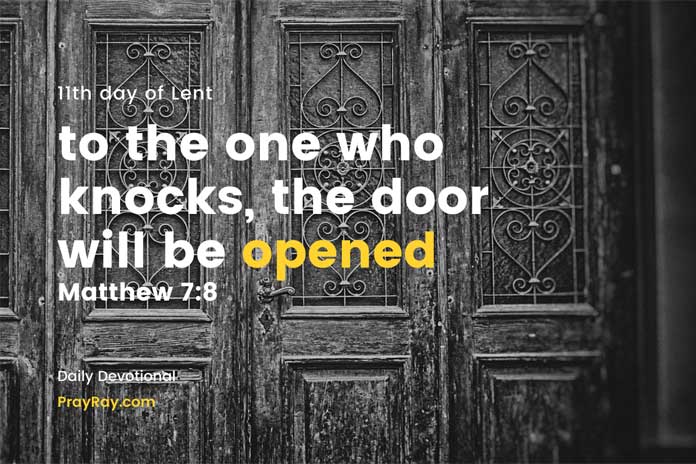
This screenshot has width=696, height=464. I want to click on doors, so click(232, 95), click(261, 84).